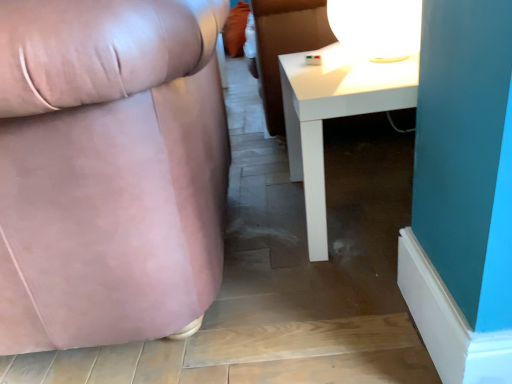
Question: Considering the positions of matte pink fabric chair at left and white glossy table lamp at upper right in the image, is matte pink fabric chair at left wider or thinner than white glossy table lamp at upper right?

Choices:
 (A) thin
 (B) wide

Answer: (B)

Question: From the image's perspective, is matte pink fabric chair at left positioned above or below white glossy table lamp at upper right?

Choices:
 (A) below
 (B) above

Answer: (A)

Question: Which is farther from the white glossy table at lower right?

Choices:
 (A) matte pink fabric chair at left
 (B) white glossy table lamp at upper right

Answer: (A)

Question: Which object is the farthest from the matte pink fabric chair at left?

Choices:
 (A) white glossy table at lower right
 (B) white glossy table lamp at upper right

Answer: (B)